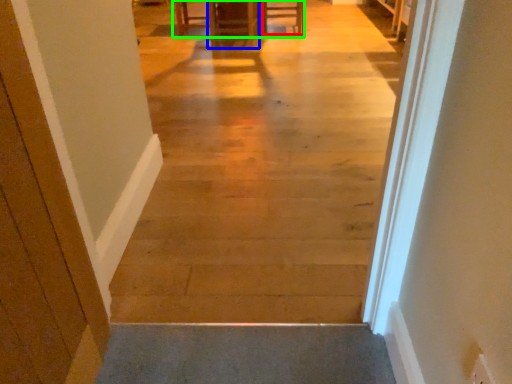
Question: Which object is positioned farthest from furniture (highlighted by a red box)? Select from furniture (highlighted by a blue box) and table (highlighted by a green box).

Choices:
 (A) furniture
 (B) table

Answer: (B)